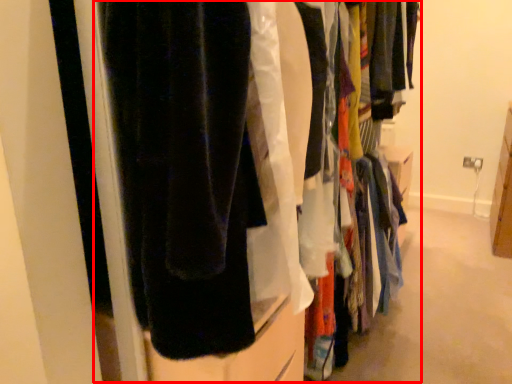
Question: From the image's perspective, where is closet (annotated by the red box) located in relation to closet in the image?

Choices:
 (A) above
 (B) below

Answer: (A)